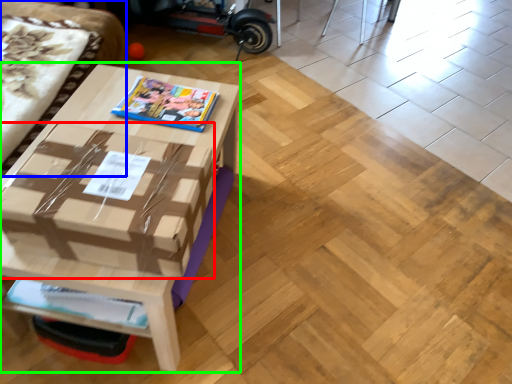
Question: Which is nearer to the cardboard box (highlighted by a red box)? couch (highlighted by a blue box) or table (highlighted by a green box).

Choices:
 (A) couch
 (B) table

Answer: (B)